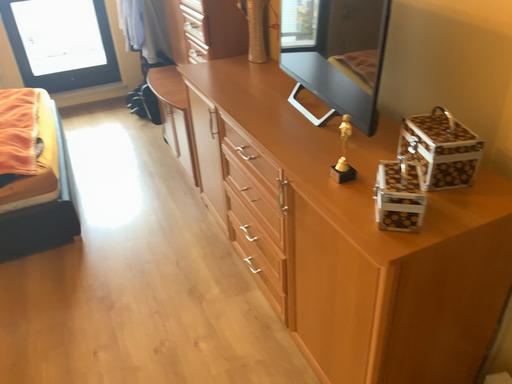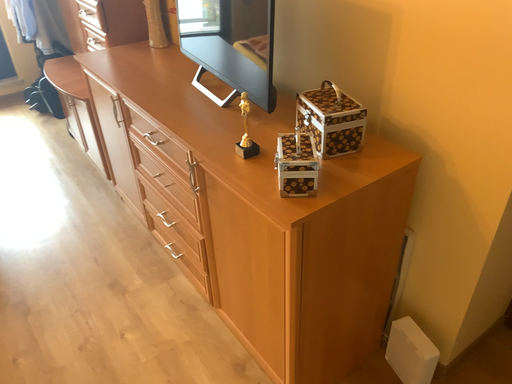
Question: Which way did the camera rotate in the video?

Choices:
 (A) rotated left
 (B) rotated right

Answer: (B)